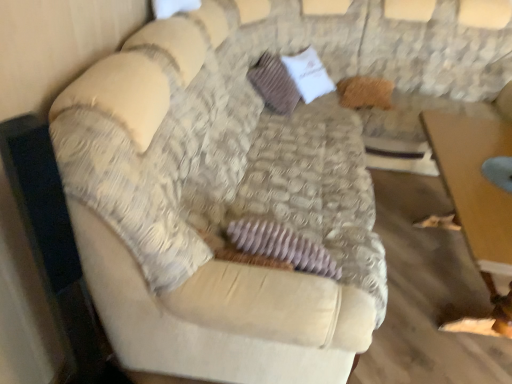
Question: Is brown textured pillow at center in front of velvet beige couch at center?

Choices:
 (A) yes
 (B) no

Answer: (B)

Question: From a real-world perspective, is brown textured pillow at center below velvet beige couch at center?

Choices:
 (A) yes
 (B) no

Answer: (A)

Question: Is brown textured pillow at center to the left of velvet beige couch at center from the viewer's perspective?

Choices:
 (A) no
 (B) yes

Answer: (A)

Question: Is brown textured pillow at center bigger than velvet beige couch at center?

Choices:
 (A) no
 (B) yes

Answer: (A)

Question: Is the surface of brown textured pillow at center in direct contact with velvet beige couch at center?

Choices:
 (A) no
 (B) yes

Answer: (A)

Question: In terms of height, does velvet beige couch at center look taller or shorter compared to brown textured pillow at center?

Choices:
 (A) short
 (B) tall

Answer: (B)

Question: Looking at their shapes, would you say velvet beige couch at center is wider or thinner than brown textured pillow at center?

Choices:
 (A) thin
 (B) wide

Answer: (B)

Question: From the image's perspective, relative to brown textured pillow at center, is velvet beige couch at center above or below?

Choices:
 (A) above
 (B) below

Answer: (B)

Question: Based on their sizes in the image, would you say velvet beige couch at center is bigger or smaller than brown textured pillow at center?

Choices:
 (A) small
 (B) big

Answer: (B)

Question: Looking at their shapes, would you say brown textured pillow at center is wider or thinner than velvet beige couch at center?

Choices:
 (A) thin
 (B) wide

Answer: (A)

Question: In the image, is brown textured pillow at center positioned in front of or behind velvet beige couch at center?

Choices:
 (A) front
 (B) behind

Answer: (B)

Question: Considering the relative positions of brown textured pillow at center and velvet beige couch at center in the image provided, is brown textured pillow at center to the left or to the right of velvet beige couch at center?

Choices:
 (A) left
 (B) right

Answer: (B)

Question: Considering the positions of brown textured pillow at center and velvet beige couch at center in the image, is brown textured pillow at center taller or shorter than velvet beige couch at center?

Choices:
 (A) tall
 (B) short

Answer: (B)

Question: Is point (180, 354) closer or farther from the camera than point (456, 145)?

Choices:
 (A) farther
 (B) closer

Answer: (B)

Question: From their relative heights in the image, would you say velvet beige couch at center is taller or shorter than wooden table at lower right?

Choices:
 (A) tall
 (B) short

Answer: (A)